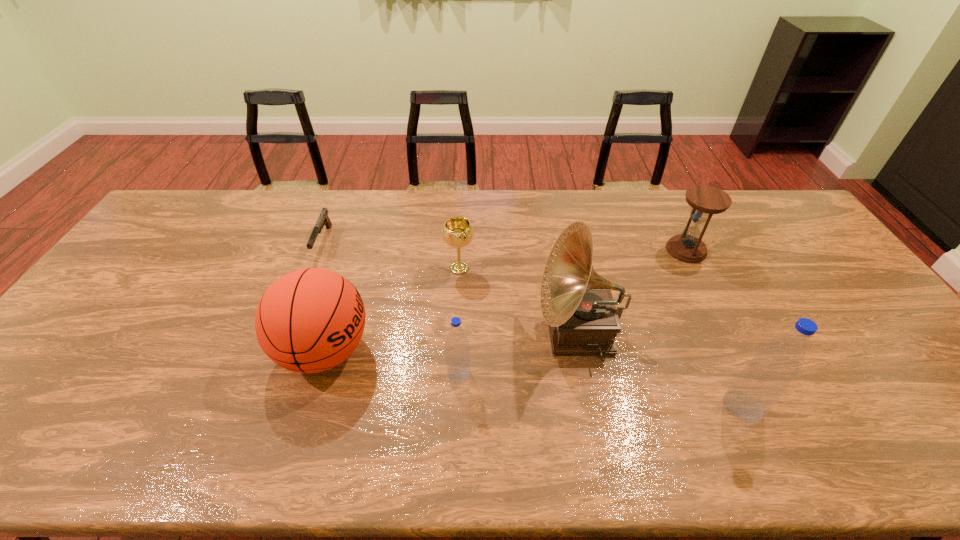
Find the location of a particular element. blank area in the image that satisfies the following two spatial constraints: 1. at the muzzle end of the shortest object; 2. on the right side of the second shortest object is located at coordinates (313, 268).